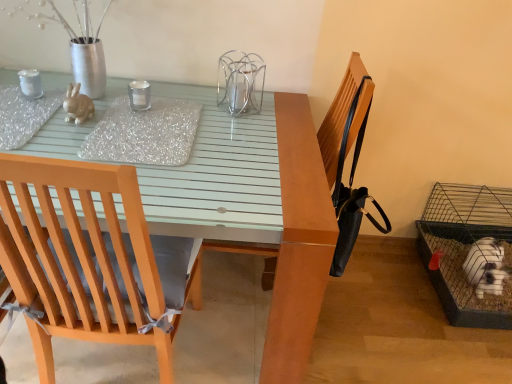
Question: From the image's perspective, is clear glass candle at center located above or below black leather chair at upper right?

Choices:
 (A) below
 (B) above

Answer: (B)

Question: In terms of width, does clear glass candle at center look wider or thinner when compared to black leather chair at upper right?

Choices:
 (A) wide
 (B) thin

Answer: (B)

Question: Which object is the farthest from the matte glass table at center?

Choices:
 (A) clear glass candle at center
 (B) clear glass candle holder at center, placed as the second bird cage when sorted from right to left
 (C) black leather chair at upper right
 (D) wooden chair at left
 (E) matte ceramic rabbit at upper left

Answer: (E)

Question: Estimate the real-world distances between objects in this image. Which object is farther from the matte glass table at center?

Choices:
 (A) matte ceramic rabbit at upper left
 (B) wooden chair at left
 (C) black leather chair at upper right
 (D) clear glass candle holder at center, which is the 1th bird cage from front to back
 (E) wire mesh cage at lower right, acting as the 2th bird cage starting from the left

Answer: (E)